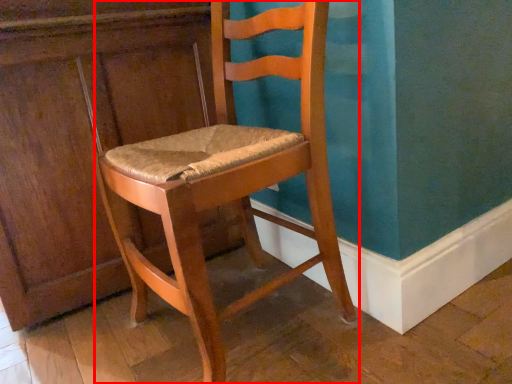
Question: Observing the image, what is the correct spatial positioning of chair (annotated by the red box) in reference to dresser?

Choices:
 (A) left
 (B) right

Answer: (B)